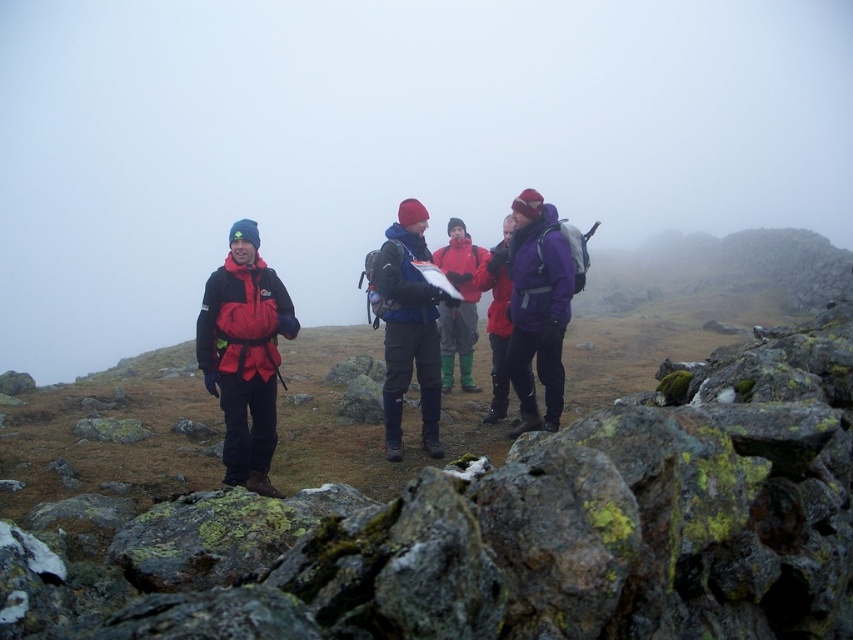
Does rough textured rock at lower left have a lesser height compared to matte blue jacket at center?

Yes.

Which is more to the left, rough textured rock at lower left or matte blue jacket at center?

matte blue jacket at center is more to the left.

Identify the location of rough textured rock at lower left. (521, 531).

Between rough textured rock at lower left and purple fleece jacket at center, which one appears on the right side from the viewer's perspective?

purple fleece jacket at center is more to the right.

Does rough textured rock at lower left have a greater width compared to purple fleece jacket at center?

Yes.

Is point (497, 600) less distant than point (514, 364)?

Yes, it is.

The width and height of the screenshot is (853, 640). I want to click on rough textured rock at lower left, so click(x=521, y=531).

Is rough textured rock at lower left in front of purple softshell jacket at center?

Yes, rough textured rock at lower left is closer to the viewer.

Is rough textured rock at lower left smaller than purple softshell jacket at center?

No, rough textured rock at lower left is not smaller than purple softshell jacket at center.

I want to click on rough textured rock at lower left, so click(521, 531).

I want to click on rough textured rock at lower left, so click(x=521, y=531).